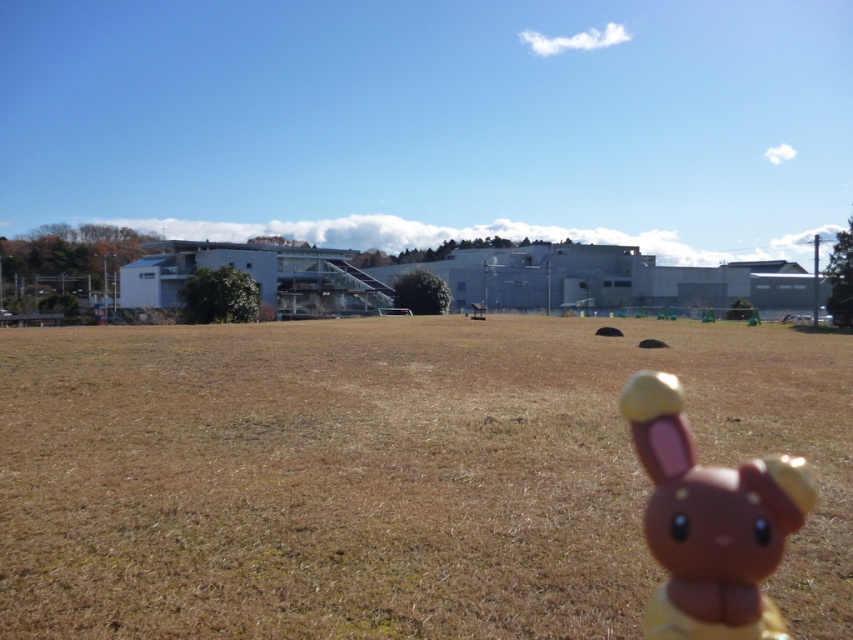
Question: Does brown grass at center appear on the left side of brown matte plush toy at lower right?

Choices:
 (A) yes
 (B) no

Answer: (B)

Question: Is brown grass at center below brown matte plush toy at lower right?

Choices:
 (A) no
 (B) yes

Answer: (B)

Question: Which point is farther to the camera?

Choices:
 (A) brown matte plush toy at lower right
 (B) brown grass at center

Answer: (B)

Question: Which object is closer to the camera taking this photo?

Choices:
 (A) brown matte plush toy at lower right
 (B) brown grass at center

Answer: (A)

Question: Can you confirm if brown grass at center is positioned to the right of brown matte plush toy at lower right?

Choices:
 (A) yes
 (B) no

Answer: (A)